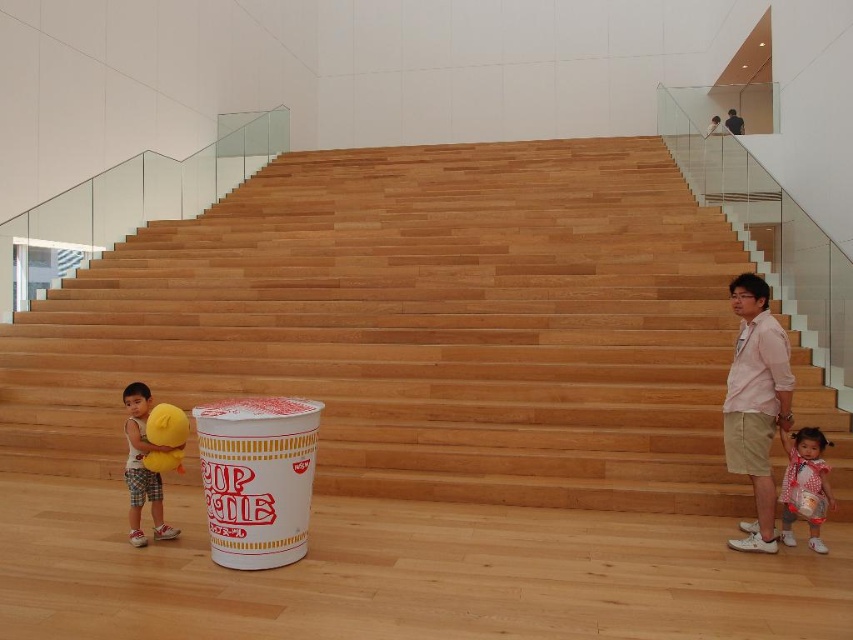
In the scene shown: Is wooden stairs at center smaller than white polka dot dress at lower right?

Actually, wooden stairs at center might be larger than white polka dot dress at lower right.

Image resolution: width=853 pixels, height=640 pixels. What do you see at coordinates (416, 326) in the screenshot?
I see `wooden stairs at center` at bounding box center [416, 326].

Is point (445, 218) positioned before point (786, 500)?

That is False.

Locate an element on the screen. Image resolution: width=853 pixels, height=640 pixels. wooden stairs at center is located at coordinates 416,326.

Is the position of wooden stairs at center less distant than that of matte yellow plush toy at lower left?

No, it is not.

Which of these two, wooden stairs at center or matte yellow plush toy at lower left, stands shorter?

matte yellow plush toy at lower left is shorter.

At what (x,y) coordinates should I click in order to perform the action: click on wooden stairs at center. Please return your answer as a coordinate pair (x, y). Image resolution: width=853 pixels, height=640 pixels. Looking at the image, I should click on (416, 326).

Identify the location of wooden stairs at center. This screenshot has width=853, height=640. (416, 326).

Does pink cotton shirt at right lie in front of white polka dot dress at lower right?

Yes, it is in front of white polka dot dress at lower right.

Which is below, pink cotton shirt at right or white polka dot dress at lower right?

white polka dot dress at lower right

Is point (750, 541) farther from viewer compared to point (828, 502)?

No, it is not.

Identify the location of pink cotton shirt at right. This screenshot has width=853, height=640. (755, 403).